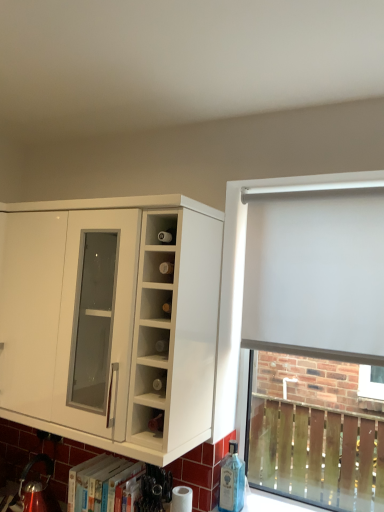
Find the location of a particular element. white matte roller blind at right is located at coordinates (311, 335).

Where is `white glossy cabinet at left`? This screenshot has width=384, height=512. white glossy cabinet at left is located at coordinates (130, 321).

The image size is (384, 512). What do you see at coordinates (316, 273) in the screenshot?
I see `white fabric curtain at right` at bounding box center [316, 273].

Identify the location of white fabric curtain at right. (316, 273).

The image size is (384, 512). In order to click on white matte roller blind at right in this screenshot , I will do `click(311, 335)`.

Is the position of white fabric curtain at right more distant than that of white glossy cabinet at left?

Yes, white fabric curtain at right is further from the camera.

From a real-world perspective, between white fabric curtain at right and white glossy cabinet at left, who is vertically lower?

In real-world perspective, white glossy cabinet at left is lower.

From the picture: Is white fabric curtain at right bigger than white glossy cabinet at left?

Incorrect, white fabric curtain at right is not larger than white glossy cabinet at left.

Does white fabric curtain at right turn towards white glossy cabinet at left?

No.

From the picture: From the image's perspective, is white fabric curtain at right located above white matte roller blind at right?

Yes, from the image's perspective, white fabric curtain at right is on top of white matte roller blind at right.

Is white fabric curtain at right bigger than white matte roller blind at right?

Yes.

Which object is further away from the camera taking this photo, white fabric curtain at right or white matte roller blind at right?

white matte roller blind at right is more distant.

Which of these two, white fabric curtain at right or white matte roller blind at right, stands taller?

white matte roller blind at right.

Which is behind, white glossy cabinet at left or white fabric curtain at right?

Positioned behind is white fabric curtain at right.

From a real-world perspective, who is located lower, white glossy cabinet at left or white fabric curtain at right?

white glossy cabinet at left is physically lower.

Between white glossy cabinet at left and white fabric curtain at right, which one has more height?

white glossy cabinet at left is taller.

Based on the photo, is white glossy cabinet at left oriented towards white fabric curtain at right?

No.

Is white matte roller blind at right not inside white fabric curtain at right?

That's incorrect, white matte roller blind at right is not completely outside white fabric curtain at right.

From the image's perspective, is white matte roller blind at right above white fabric curtain at right?

No.

Based on the photo, is white matte roller blind at right positioned with its back to white fabric curtain at right?

Correct, white matte roller blind at right is looking away from white fabric curtain at right.

Does white matte roller blind at right have a smaller size compared to white fabric curtain at right?

Correct, white matte roller blind at right occupies less space than white fabric curtain at right.

From a real-world perspective, does white glossy cabinet at left sit lower than white matte roller blind at right?

No, from a real-world perspective, white glossy cabinet at left is not under white matte roller blind at right.

Can you confirm if white glossy cabinet at left is wider than white matte roller blind at right?

Yes, white glossy cabinet at left is wider than white matte roller blind at right.

Is white glossy cabinet at left turned away from white matte roller blind at right?

white glossy cabinet at left is not turned away from white matte roller blind at right.

Is white matte roller blind at right bigger or smaller than white glossy cabinet at left?

In the image, white matte roller blind at right appears to be smaller than white glossy cabinet at left.

You are a GUI agent. You are given a task and a screenshot of the screen. Output one action in this format:
    pyautogui.click(x=<x>, y=<y>)
    Task: Click on the cabinetry that is on the left side of white matte roller blind at right
    The height and width of the screenshot is (512, 384).
    Given the screenshot: What is the action you would take?
    pyautogui.click(x=130, y=321)

Considering the relative sizes of white matte roller blind at right and white glossy cabinet at left in the image provided, is white matte roller blind at right taller than white glossy cabinet at left?

Correct, white matte roller blind at right is much taller as white glossy cabinet at left.

Is white matte roller blind at right wider than white glossy cabinet at left?

Incorrect, the width of white matte roller blind at right does not surpass that of white glossy cabinet at left.

What are the coordinates of `cabinetry in front of the white fabric curtain at right` in the screenshot? It's located at (130, 321).

Identify the location of curtain above the white matte roller blind at right (from the image's perspective). (316, 273).

Based on their spatial positions, is white fabric curtain at right or white glossy cabinet at left closer to white matte roller blind at right?

Result: white fabric curtain at right is positioned closer to the anchor white matte roller blind at right.

Based on their spatial positions, is white fabric curtain at right or white matte roller blind at right closer to white glossy cabinet at left?

The object closer to white glossy cabinet at left is white fabric curtain at right.

When comparing their distances from white matte roller blind at right, does white glossy cabinet at left or white fabric curtain at right seem closer?

Based on the image, white fabric curtain at right appears to be nearer to white matte roller blind at right.

Based on their spatial positions, is white matte roller blind at right or white glossy cabinet at left further from white fabric curtain at right?

The object further to white fabric curtain at right is white matte roller blind at right.

Looking at the image, which one is located further to white fabric curtain at right, white glossy cabinet at left or white matte roller blind at right?

The object further to white fabric curtain at right is white matte roller blind at right.

Looking at the image, which one is located further to white glossy cabinet at left, white matte roller blind at right or white fabric curtain at right?

white matte roller blind at right is positioned further to the anchor white glossy cabinet at left.

Where is `curtain between white glossy cabinet at left and white matte roller blind at right`? The height and width of the screenshot is (512, 384). curtain between white glossy cabinet at left and white matte roller blind at right is located at coordinates (316, 273).